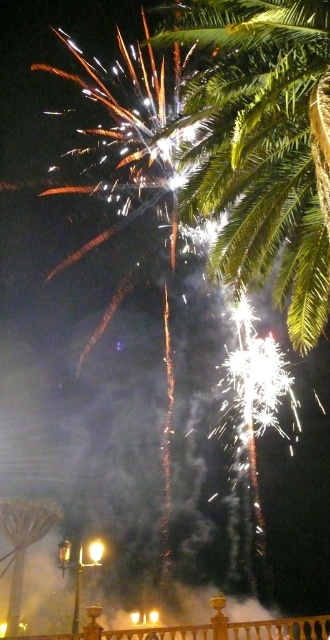
Describe the element at coordinates (203, 628) in the screenshot. I see `wooden railing at lower center` at that location.

Looking at this image, who is lower down, wooden railing at lower center or metallic streetlight at center?

metallic streetlight at center

Find the location of `wooden railing at lower center`. wooden railing at lower center is located at coordinates (203, 628).

Can you confirm if wooden railing at lower center is positioned below metallic yellow light at center?

Actually, wooden railing at lower center is above metallic yellow light at center.

Does wooden railing at lower center lie in front of metallic yellow light at center?

That is True.

Who is more distant from viewer, (61, 636) or (155, 612)?

The point (155, 612) is more distant.

Find the location of a particular element. The image size is (330, 640). wooden railing at lower center is located at coordinates (203, 628).

From the picture: Is metallic streetlight at lower left taller than metallic streetlight at center?

Yes.

Is metallic streetlight at lower left bigger than metallic streetlight at center?

Yes.

Between point (58, 545) and point (135, 620), which one is positioned in front?

Point (58, 545) is in front.

This screenshot has width=330, height=640. Identify the location of metallic streetlight at lower left. (64, 552).